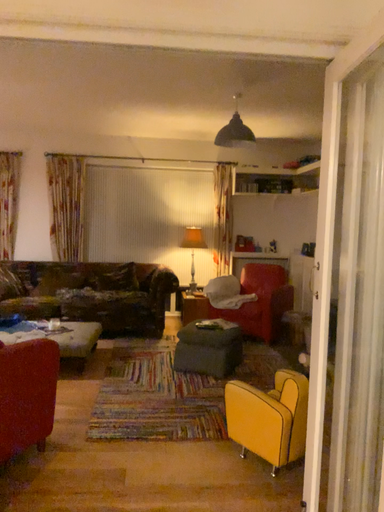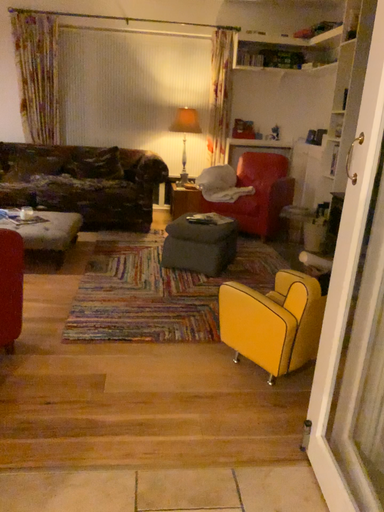
Question: How did the camera likely rotate when shooting the video?

Choices:
 (A) rotated upward
 (B) rotated downward

Answer: (B)